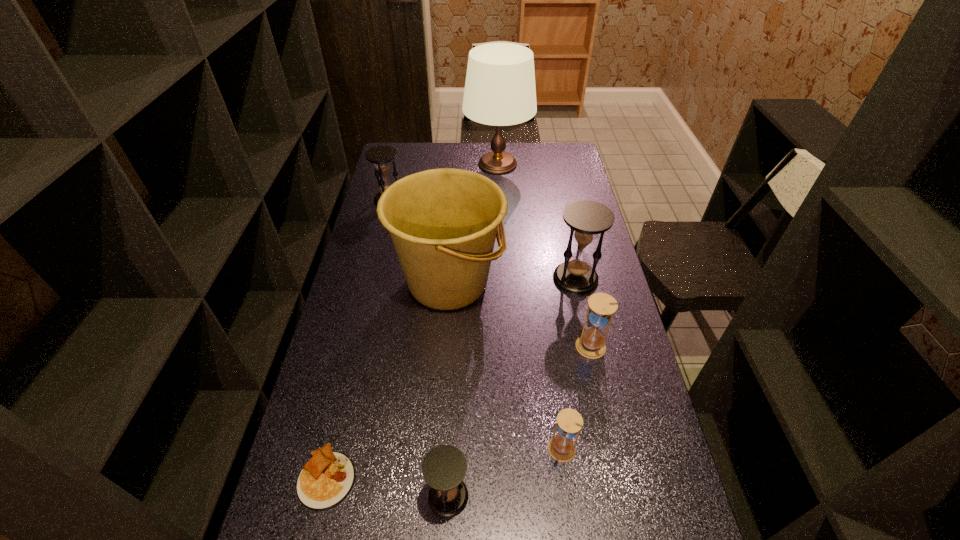
Where is `free area in between the bigger white hourglass and the farthest object`? free area in between the bigger white hourglass and the farthest object is located at coordinates (544, 256).

The height and width of the screenshot is (540, 960). What are the coordinates of `empty space between the smaller white hourglass and the second farthest object` in the screenshot? It's located at (475, 325).

At what (x,y) coordinates should I click in order to perform the action: click on free space between the third nearest hourglass and the seventh shortest object. Please return your answer as a coordinate pair (x, y). The width and height of the screenshot is (960, 540). Looking at the image, I should click on (519, 315).

At what (x,y) coordinates should I click in order to perform the action: click on free spot between the smaller white hourglass and the fourth nearest hourglass. Please return your answer as a coordinate pair (x, y). The width and height of the screenshot is (960, 540). Looking at the image, I should click on (568, 364).

You are a GUI agent. You are given a task and a screenshot of the screen. Output one action in this format:
    pyautogui.click(x=<x>, y=<y>)
    Task: Click on the unoccupied area between the left white hourglass and the white lamp
    The image size is (960, 540).
    Given the screenshot: What is the action you would take?
    pos(530,307)

At what (x,y) coordinates should I click in order to perform the action: click on vacant space in between the bucket and the bigger white hourglass. Please return your answer as a coordinate pair (x, y). This screenshot has height=540, width=960. Looking at the image, I should click on (519, 315).

Find the location of `free spot between the shortest object and the bucket`. free spot between the shortest object and the bucket is located at coordinates (388, 380).

Find the location of a particular element. empty space between the tallest hourglass and the third nearest hourglass is located at coordinates (584, 313).

What are the coordinates of `the sixth closest object to the tallest object` in the screenshot? It's located at (325, 481).

Locate an element on the screen. This screenshot has height=540, width=960. object that stands as the third closest to the bigger white hourglass is located at coordinates (561, 447).